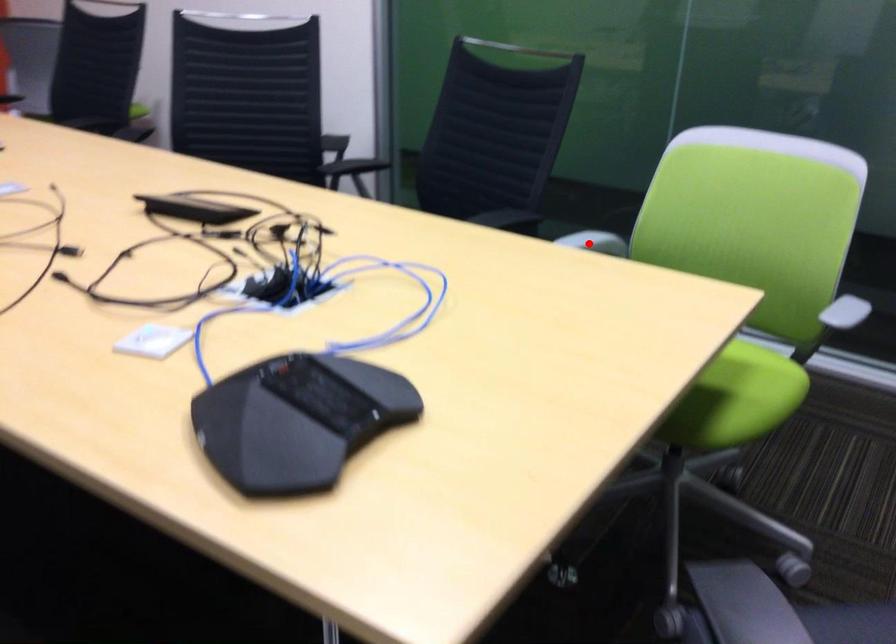
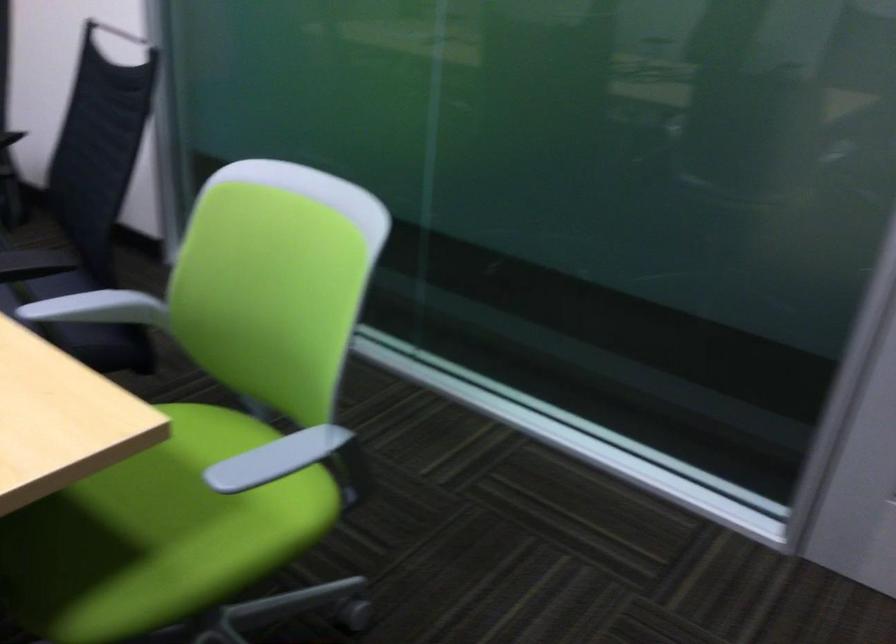
The point at the highlighted location is marked in the first image. Where is the corresponding point in the second image?

(97, 308)